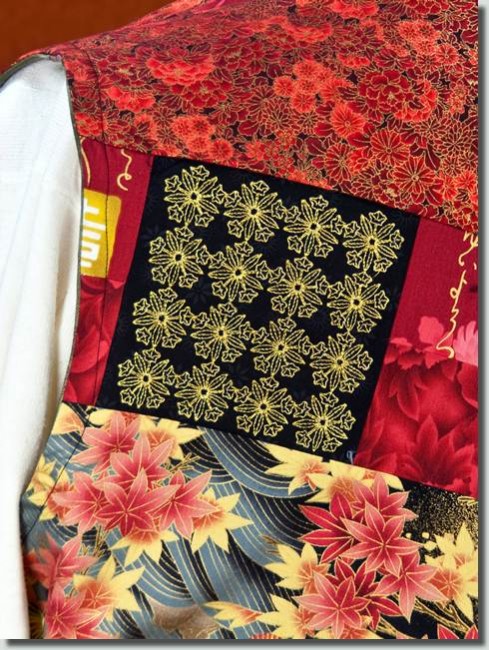
The image size is (489, 650). What are the coordinates of `inside edge of pillow case` in the screenshot? It's located at (83, 186).